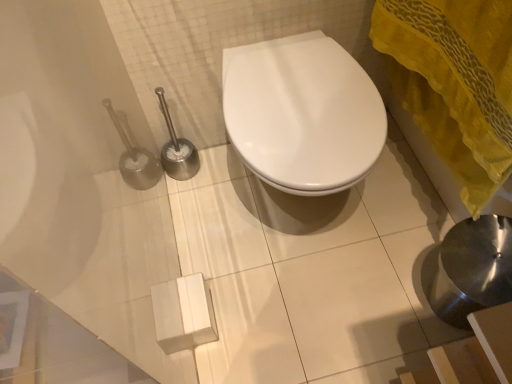
Question: Is yellow sheer fabric at right bigger than white glossy toilet at center?

Choices:
 (A) yes
 (B) no

Answer: (B)

Question: From the image's perspective, is yellow sheer fabric at right over white glossy toilet at center?

Choices:
 (A) yes
 (B) no

Answer: (A)

Question: Are yellow sheer fabric at right and white glossy toilet at center far apart?

Choices:
 (A) yes
 (B) no

Answer: (B)

Question: Is yellow sheer fabric at right wider than white glossy toilet at center?

Choices:
 (A) yes
 (B) no

Answer: (B)

Question: Is yellow sheer fabric at right in front of white glossy toilet at center?

Choices:
 (A) yes
 (B) no

Answer: (A)

Question: From the image's perspective, is yellow sheer fabric at right beneath white glossy toilet at center?

Choices:
 (A) no
 (B) yes

Answer: (A)

Question: Is white glossy toilet at center to the left of yellow sheer fabric at right from the viewer's perspective?

Choices:
 (A) yes
 (B) no

Answer: (A)

Question: Can you confirm if white glossy toilet at center is smaller than yellow sheer fabric at right?

Choices:
 (A) yes
 (B) no

Answer: (B)

Question: From a real-world perspective, is white glossy toilet at center on yellow sheer fabric at right?

Choices:
 (A) no
 (B) yes

Answer: (A)

Question: From the image's perspective, is white glossy toilet at center on yellow sheer fabric at right?

Choices:
 (A) no
 (B) yes

Answer: (A)

Question: Is white glossy toilet at center in contact with yellow sheer fabric at right?

Choices:
 (A) no
 (B) yes

Answer: (A)

Question: Does white glossy toilet at center have a greater width compared to yellow sheer fabric at right?

Choices:
 (A) no
 (B) yes

Answer: (B)

Question: Is point (407, 13) positioned closer to the camera than point (303, 86)?

Choices:
 (A) closer
 (B) farther

Answer: (A)